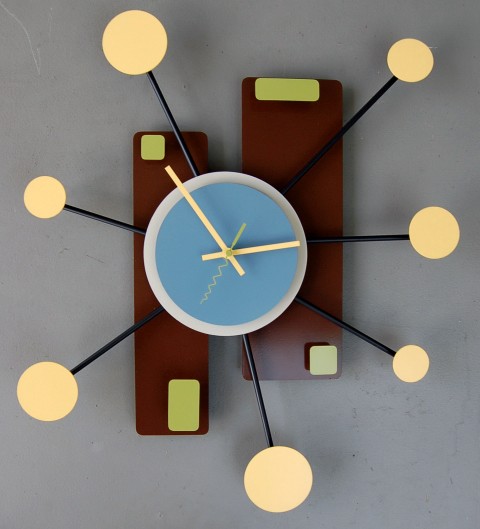
Identify the location of empty space top left of wall. (46, 91).